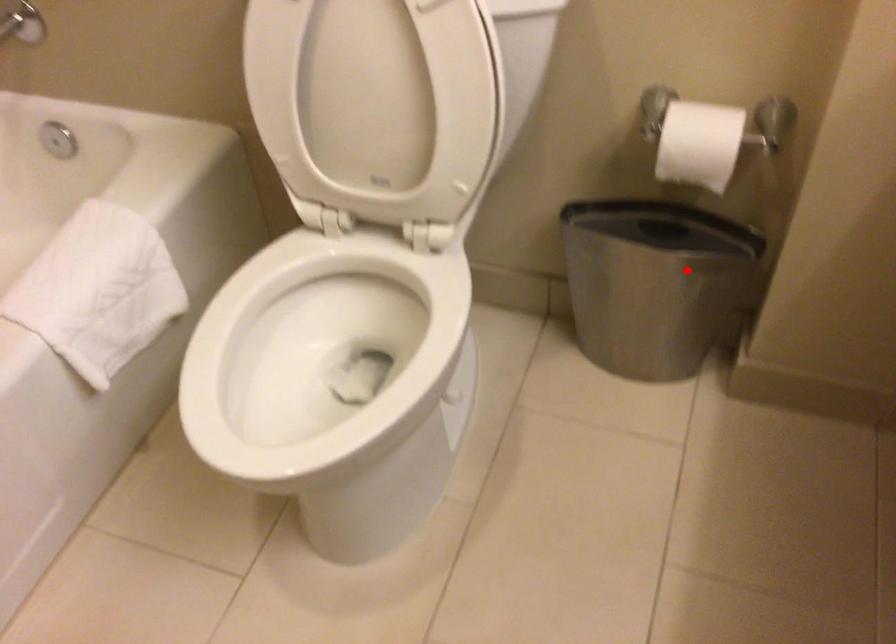
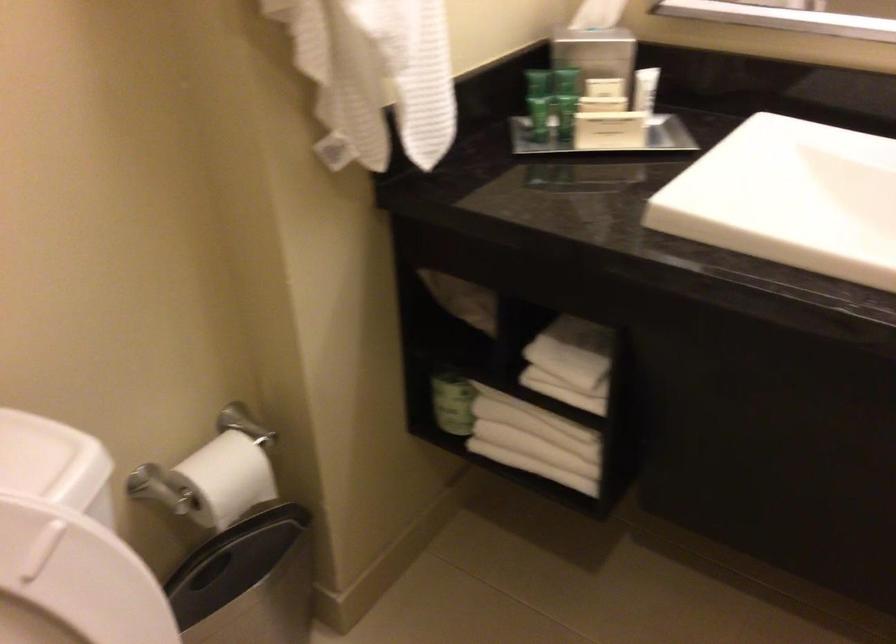
Question: I am providing you with two images of the same scene from different viewpoints. A red point is marked on the first image. Is the red point's position out of view in image 2?

Choices:
 (A) Yes
 (B) No

Answer: (B)